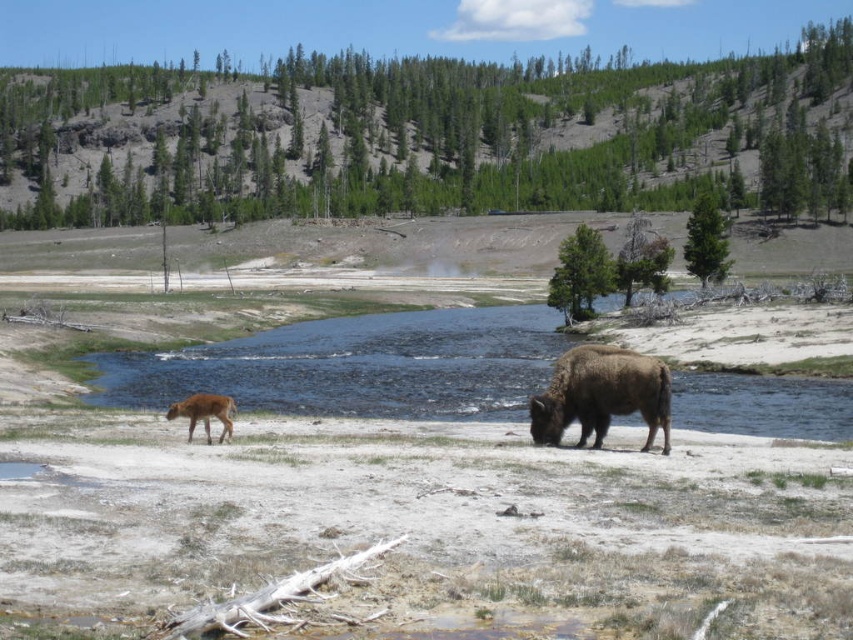
You are a photographer trying to capture the brown furry yak at lower right and the brown fur at lower left in the same frame. Based on their sizes, which one do you need to zoom in more on to ensure it appears larger in your photo?

The brown fur at lower left is much smaller than the brown furry yak at lower right, so you need to zoom in more on the brown fur at lower left to make it appear larger in the photo.

You are standing at the point labeled point (602,400) and want to walk to the point labeled point (180,403). Which direction should you face to walk directly towards your destination?

Since point (602,400) is closer to the camera than point (180,403), you should face downwards to walk directly towards point (180,403).

You are a photographer standing in the middle of the sandy area and want to take a photo of the brown furry yak at lower right and the brown fur at lower left. Which object is positioned higher in the frame?

The brown furry yak at lower right is positioned higher in the frame than the brown fur at lower left.